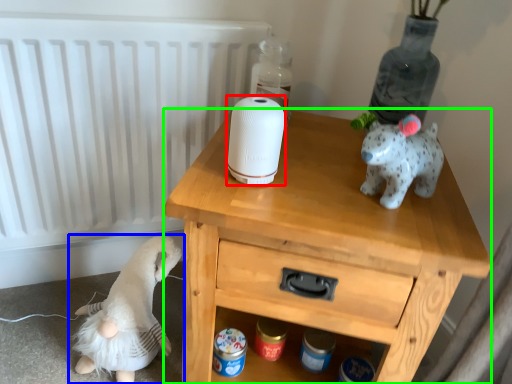
Question: Considering the real-world distances, which object is closest to toilet paper (highlighted by a red box)? toy (highlighted by a blue box) or nightstand (highlighted by a green box).

Choices:
 (A) toy
 (B) nightstand

Answer: (B)